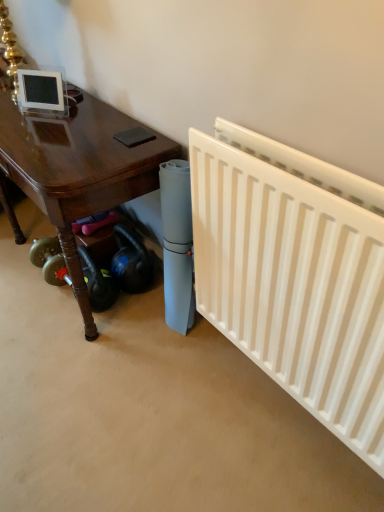
Question: From a real-world perspective, is glossy wood table at lower left physically above white matte radiator at right?

Choices:
 (A) yes
 (B) no

Answer: (B)

Question: Can you confirm if glossy wood table at lower left is taller than white matte radiator at right?

Choices:
 (A) no
 (B) yes

Answer: (A)

Question: Considering the relative sizes of glossy wood table at lower left and white matte radiator at right in the image provided, is glossy wood table at lower left smaller than white matte radiator at right?

Choices:
 (A) yes
 (B) no

Answer: (B)

Question: Is glossy wood table at lower left behind white matte radiator at right?

Choices:
 (A) no
 (B) yes

Answer: (B)

Question: Can you confirm if glossy wood table at lower left is wider than white matte radiator at right?

Choices:
 (A) yes
 (B) no

Answer: (A)

Question: Is glossy wood table at lower left to the right of white matte radiator at right from the viewer's perspective?

Choices:
 (A) yes
 (B) no

Answer: (B)

Question: Can you confirm if white matte radiator at right is taller than glossy wood table at lower left?

Choices:
 (A) yes
 (B) no

Answer: (A)

Question: Is white matte radiator at right touching glossy wood table at lower left?

Choices:
 (A) no
 (B) yes

Answer: (A)

Question: Can you confirm if white matte radiator at right is thinner than glossy wood table at lower left?

Choices:
 (A) no
 (B) yes

Answer: (B)

Question: Is white matte radiator at right surrounding glossy wood table at lower left?

Choices:
 (A) no
 (B) yes

Answer: (A)

Question: Considering the relative sizes of white matte radiator at right and glossy wood table at lower left in the image provided, is white matte radiator at right smaller than glossy wood table at lower left?

Choices:
 (A) no
 (B) yes

Answer: (B)

Question: Is white matte radiator at right to the right of glossy wood table at lower left from the viewer's perspective?

Choices:
 (A) yes
 (B) no

Answer: (A)

Question: Would you say glossy wood table at lower left is inside or outside white matte radiator at right?

Choices:
 (A) outside
 (B) inside

Answer: (A)